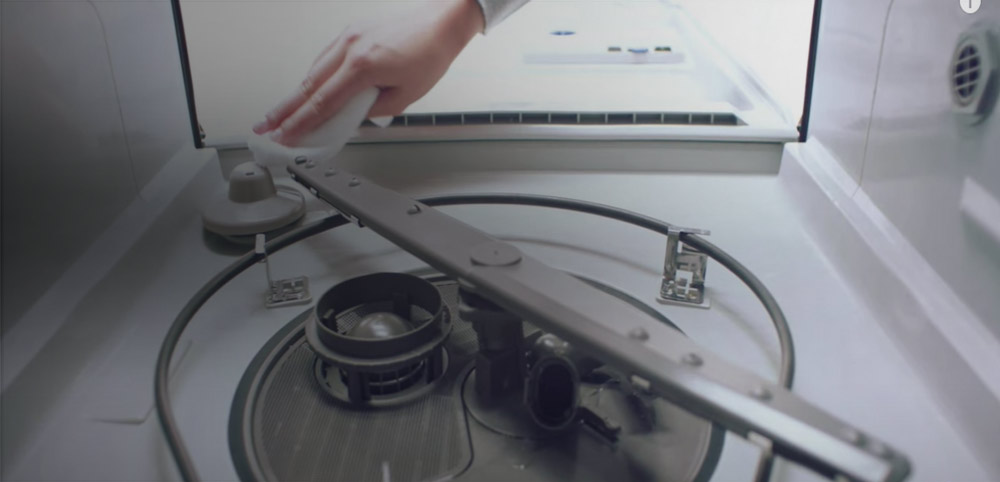
Find the location of a particular element. base of dishwasher is located at coordinates (806, 331).